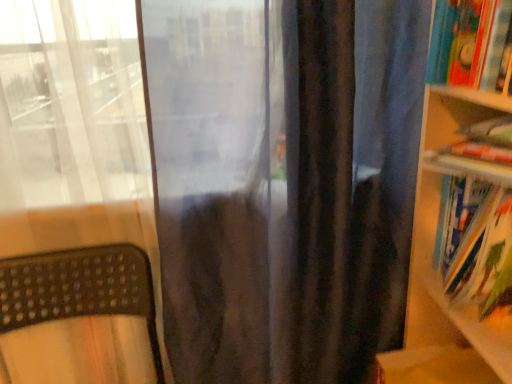
Question: Would you say hardcover books at right is part of hardcover book at upper right, the 1th book in the top-to-bottom sequence,'s contents?

Choices:
 (A) yes
 (B) no

Answer: (B)

Question: Is the depth of hardcover book at upper right, the 1th book in the top-to-bottom sequence, less than that of hardcover books at right?

Choices:
 (A) yes
 (B) no

Answer: (B)

Question: Can you confirm if hardcover book at upper right, the 1th book in the top-to-bottom sequence, is smaller than hardcover books at right?

Choices:
 (A) yes
 (B) no

Answer: (A)

Question: Does hardcover book at upper right, which ranks as the 2th book in bottom-to-top order, turn towards hardcover books at right?

Choices:
 (A) yes
 (B) no

Answer: (B)

Question: Considering the relative sizes of hardcover book at upper right, the 1th book in the top-to-bottom sequence, and hardcover books at right in the image provided, is hardcover book at upper right, the 1th book in the top-to-bottom sequence, bigger than hardcover books at right?

Choices:
 (A) no
 (B) yes

Answer: (A)

Question: Is hardcover book at upper right, the 1th book in the top-to-bottom sequence, shorter than hardcover books at right?

Choices:
 (A) no
 (B) yes

Answer: (B)

Question: From a real-world perspective, is hardcover books at right physically below hardcover book at right, arranged as the first book when ordered from the bottom?

Choices:
 (A) yes
 (B) no

Answer: (B)

Question: From the image's perspective, is hardcover books at right beneath hardcover book at right, which ranks as the 2th book in top-to-bottom order?

Choices:
 (A) yes
 (B) no

Answer: (B)

Question: Considering the relative positions of hardcover books at right and hardcover book at right, which ranks as the 2th book in top-to-bottom order, in the image provided, is hardcover books at right in front of hardcover book at right, which ranks as the 2th book in top-to-bottom order,?

Choices:
 (A) no
 (B) yes

Answer: (B)

Question: Is hardcover books at right thinner than hardcover book at right, which ranks as the 2th book in top-to-bottom order?

Choices:
 (A) yes
 (B) no

Answer: (B)

Question: Would you say hardcover book at right, arranged as the first book when ordered from the bottom, is part of hardcover books at right's contents?

Choices:
 (A) no
 (B) yes

Answer: (B)

Question: Is hardcover books at right next to hardcover book at right, which ranks as the 2th book in top-to-bottom order, and touching it?

Choices:
 (A) yes
 (B) no

Answer: (A)

Question: From the image's perspective, is hardcover book at right, which ranks as the 2th book in top-to-bottom order, located beneath hardcover books at right?

Choices:
 (A) no
 (B) yes

Answer: (B)